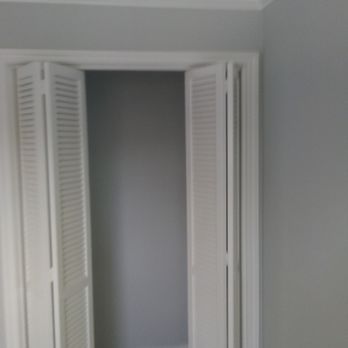
This screenshot has width=348, height=348. Find the location of `shingles (closet door)`. shingles (closet door) is located at coordinates (211, 223).